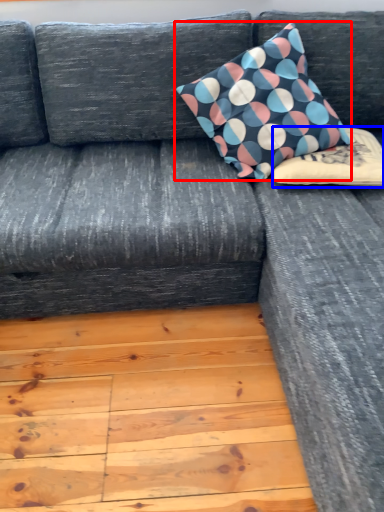
Question: Which object appears farthest to the camera in this image, pillow (highlighted by a red box) or pillow (highlighted by a blue box)?

Choices:
 (A) pillow
 (B) pillow

Answer: (B)